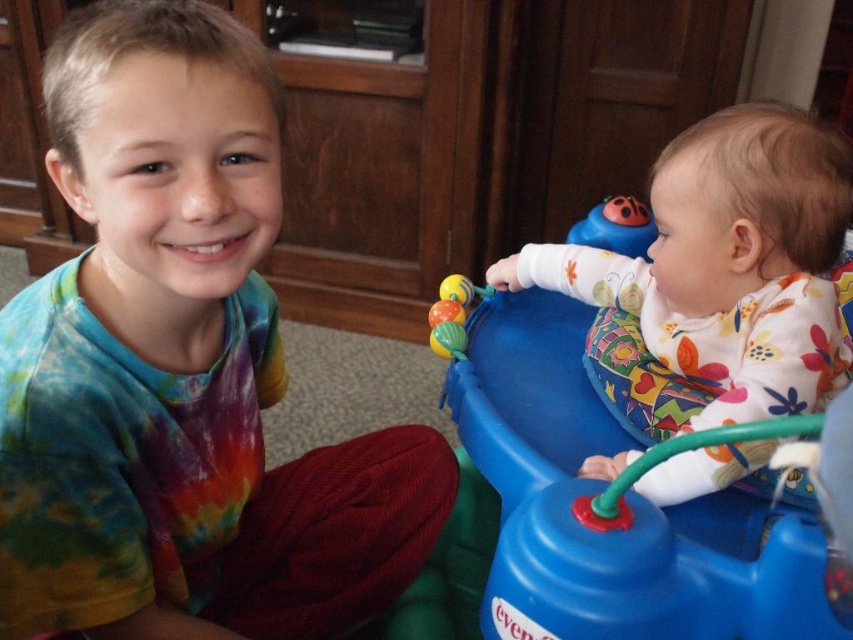
Which is more to the right, matte plastic toy at upper right or rubberized multicolored balls at center?

matte plastic toy at upper right

At what (x,y) coordinates should I click in order to perform the action: click on matte plastic toy at upper right. Please return your answer as a coordinate pair (x, y). The width and height of the screenshot is (853, 640). Looking at the image, I should click on (614, 227).

You are a GUI agent. You are given a task and a screenshot of the screen. Output one action in this format:
    pyautogui.click(x=<x>, y=<y>)
    Task: Click on the tie-dye fabric shirt at left
    
    Given the screenshot: What is the action you would take?
    pyautogui.click(x=180, y=369)

Is tie-dye fabric shirt at left taller than matte plastic toy at upper right?

Indeed, tie-dye fabric shirt at left has a greater height compared to matte plastic toy at upper right.

Based on the photo, measure the distance between tie-dye fabric shirt at left and camera.

tie-dye fabric shirt at left is 20.42 inches away from camera.

Locate an element on the screen. The height and width of the screenshot is (640, 853). tie-dye fabric shirt at left is located at coordinates (180, 369).

Who is more forward, (614, 369) or (450, 276)?

Positioned in front is point (614, 369).

This screenshot has width=853, height=640. In order to click on floral cotton baby at right in this screenshot , I will do `click(717, 276)`.